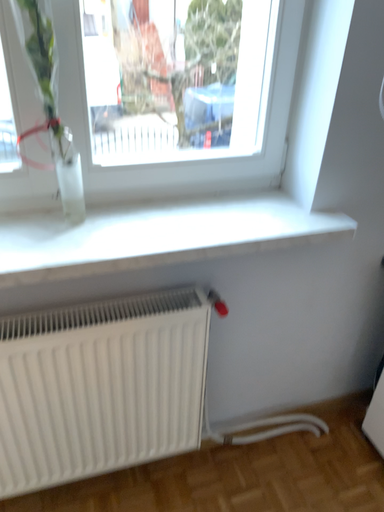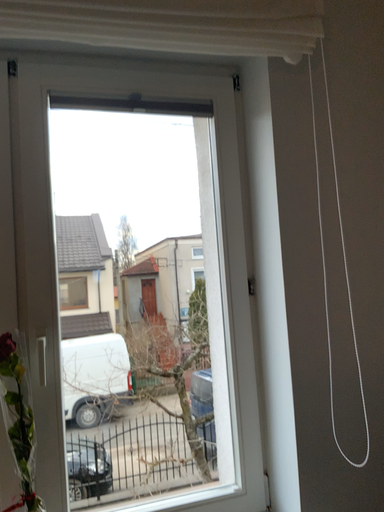
Question: Which way did the camera rotate in the video?

Choices:
 (A) rotated downward
 (B) rotated upward

Answer: (B)